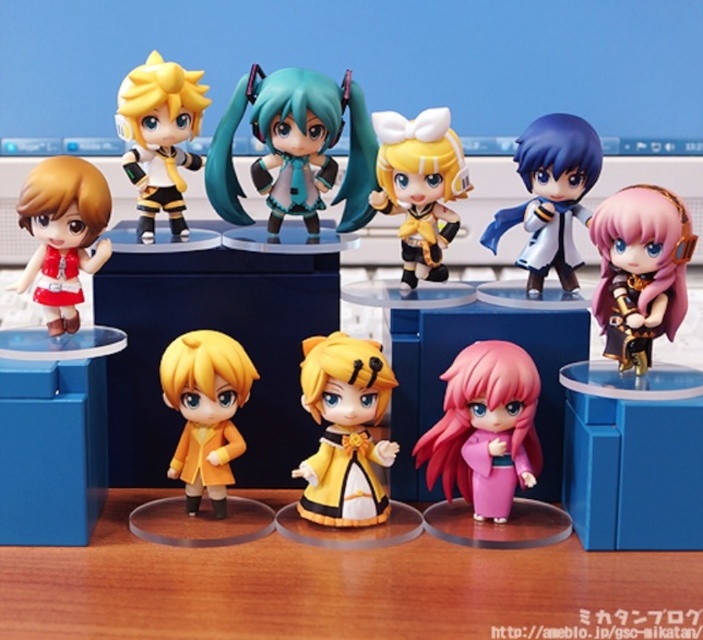
You are standing 1.5 meters away from the point at point [614,314]. Can you reach it without moving closer?

The point at point [614,314] is 1.16 meters away from you, so yes, you can reach it without moving closer since it is within your 1.5 meters range.